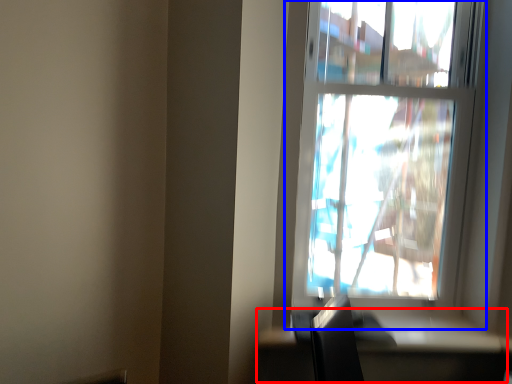
Question: Which object appears farthest to the camera in this image, table (highlighted by a red box) or window (highlighted by a blue box)?

Choices:
 (A) table
 (B) window

Answer: (B)